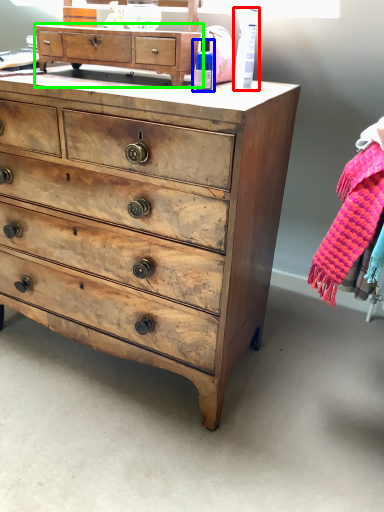
Question: Estimate the real-world distances between objects in this image. Which object is farther from toiletry (highlighted by a red box), toiletry (highlighted by a blue box) or chest of drawers (highlighted by a green box)?

Choices:
 (A) toiletry
 (B) chest of drawers

Answer: (B)